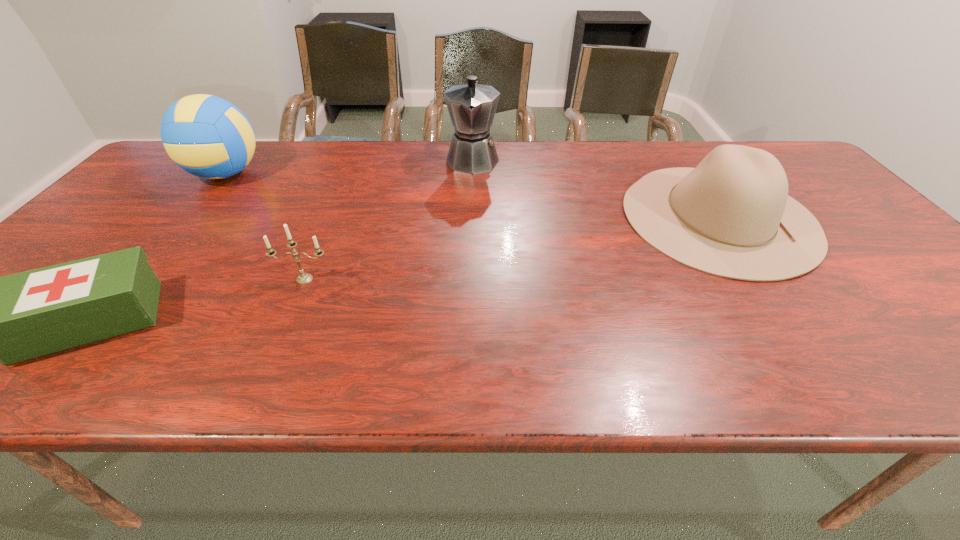
Where is `coffeepot at the far edge`? This screenshot has width=960, height=540. coffeepot at the far edge is located at coordinates (471, 106).

In order to click on volleyball positioned at the far edge in this screenshot , I will do `click(207, 136)`.

Find the location of a particular element. Image resolution: width=960 pixels, height=540 pixels. sombrero positioned at the far edge is located at coordinates (731, 216).

The height and width of the screenshot is (540, 960). What are the coordinates of `object that is at the left edge` in the screenshot? It's located at pyautogui.click(x=207, y=136).

Find the location of a particular element. The image size is (960, 540). object that is positioned at the right edge is located at coordinates (731, 216).

Where is `object present at the far left corner`? The image size is (960, 540). object present at the far left corner is located at coordinates (207, 136).

This screenshot has width=960, height=540. I want to click on object that is at the far right corner, so [731, 216].

Locate an element on the screen. Image resolution: width=960 pixels, height=540 pixels. vacant space at the far edge of the desktop is located at coordinates (694, 150).

The height and width of the screenshot is (540, 960). Find the location of `free space at the near edge`. free space at the near edge is located at coordinates (715, 373).

In the image, there is a desktop. At what (x,y) coordinates should I click in order to perform the action: click on free space at the right edge. Please return your answer as a coordinate pair (x, y). This screenshot has height=540, width=960. Looking at the image, I should click on (866, 276).